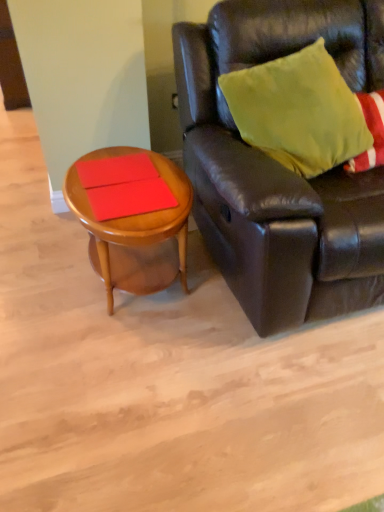
Question: Is matte red book at center, positioned as the second plank in top-to-bottom order, looking in the opposite direction of matte red book at left, the first plank viewed from the top?

Choices:
 (A) yes
 (B) no

Answer: (B)

Question: Can you confirm if matte red book at center, positioned as the 1th plank in bottom-to-top order, is bigger than matte red book at left, the first plank viewed from the top?

Choices:
 (A) yes
 (B) no

Answer: (A)

Question: Considering the relative sizes of matte red book at center, positioned as the second plank in top-to-bottom order, and matte red book at left, the first plank viewed from the top, in the image provided, is matte red book at center, positioned as the second plank in top-to-bottom order, smaller than matte red book at left, the first plank viewed from the top,?

Choices:
 (A) yes
 (B) no

Answer: (B)

Question: From the image's perspective, is matte red book at center, positioned as the 1th plank in bottom-to-top order, located above matte red book at left, the first plank viewed from the top?

Choices:
 (A) yes
 (B) no

Answer: (B)

Question: Is the position of matte red book at center, positioned as the second plank in top-to-bottom order, less distant than that of matte red book at left, positioned as the second plank in bottom-to-top order?

Choices:
 (A) no
 (B) yes

Answer: (B)

Question: Is point pos(195,198) closer or farther from the camera than point pos(142,242)?

Choices:
 (A) closer
 (B) farther

Answer: (B)

Question: Looking at the image, does leather couch at right seem bigger or smaller compared to woodenobject at left?

Choices:
 (A) small
 (B) big

Answer: (B)

Question: Which is correct: leather couch at right is inside woodenobject at left, or outside of it?

Choices:
 (A) outside
 (B) inside

Answer: (A)

Question: In terms of height, does leather couch at right look taller or shorter compared to woodenobject at left?

Choices:
 (A) tall
 (B) short

Answer: (A)

Question: From a real-world perspective, relative to matte red book at center, positioned as the 1th plank in bottom-to-top order, is leather couch at right vertically above or below?

Choices:
 (A) below
 (B) above

Answer: (B)

Question: In terms of width, does leather couch at right look wider or thinner when compared to matte red book at center, positioned as the 1th plank in bottom-to-top order?

Choices:
 (A) wide
 (B) thin

Answer: (A)

Question: Do you think leather couch at right is within matte red book at center, positioned as the 1th plank in bottom-to-top order, or outside of it?

Choices:
 (A) outside
 (B) inside

Answer: (A)

Question: From the image's perspective, relative to matte red book at center, positioned as the 1th plank in bottom-to-top order, is leather couch at right above or below?

Choices:
 (A) above
 (B) below

Answer: (A)

Question: Considering the relative positions of woodenobject at left and matte red book at left, positioned as the second plank in bottom-to-top order, in the image provided, is woodenobject at left to the left or to the right of matte red book at left, positioned as the second plank in bottom-to-top order,?

Choices:
 (A) left
 (B) right

Answer: (B)

Question: Looking at their shapes, would you say woodenobject at left is wider or thinner than matte red book at left, the first plank viewed from the top?

Choices:
 (A) wide
 (B) thin

Answer: (A)